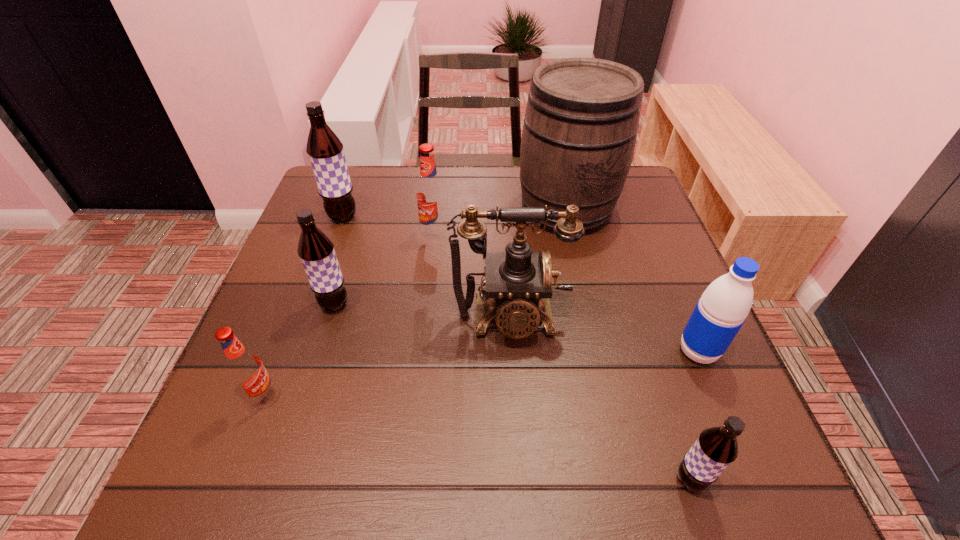
Locate an element on the screen. The height and width of the screenshot is (540, 960). free point between the wine bucket and the tallest root beer is located at coordinates (454, 213).

Identify the location of vacant area that lies between the water bottle and the second nearest object. (481, 373).

I want to click on free space between the blue water bottle and the nearer red root beer, so click(481, 373).

Identify which object is located as the second nearest to the second biggest brown root beer. Please provide its 2D coordinates. Your answer should be formatted as a tuple, i.e. [(x, y)], where the tuple contains the x and y coordinates of a point satisfying the conditions above.

[(430, 195)]

The image size is (960, 540). I want to click on the seventh closest object to the farthest brown root beer, so click(716, 448).

Identify which root beer is the third nearest to the blue water bottle. Please provide its 2D coordinates. Your answer should be formatted as a tuple, i.e. [(x, y)], where the tuple contains the x and y coordinates of a point satisfying the conditions above.

[(316, 250)]

Identify which root beer is the third nearest to the telephone. Please provide its 2D coordinates. Your answer should be formatted as a tuple, i.e. [(x, y)], where the tuple contains the x and y coordinates of a point satisfying the conditions above.

[(716, 448)]

You are a GUI agent. You are given a task and a screenshot of the screen. Output one action in this format:
    pyautogui.click(x=<x>, y=<y>)
    Task: Click on the third closest brown root beer to the wine bucket
    This screenshot has height=540, width=960.
    Given the screenshot: What is the action you would take?
    pyautogui.click(x=716, y=448)

Select which brown root beer appears as the second closest to the wine bucket. Please provide its 2D coordinates. Your answer should be formatted as a tuple, i.e. [(x, y)], where the tuple contains the x and y coordinates of a point satisfying the conditions above.

[(325, 150)]

Identify the location of vacant position in the image that satisfies the following two spatial constraints: 1. on the back side of the wine bucket; 2. on the left side of the nearer red root beer. The width and height of the screenshot is (960, 540). (335, 208).